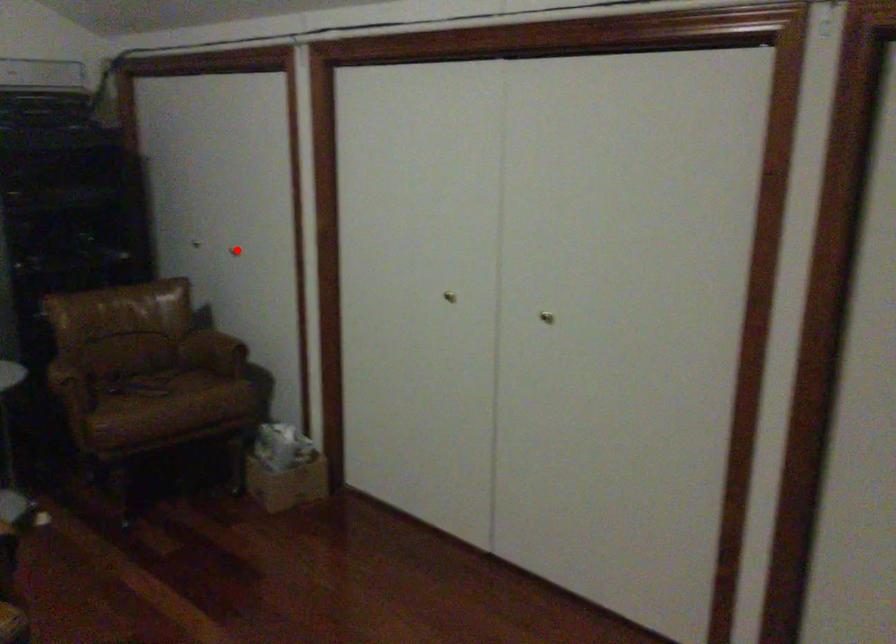
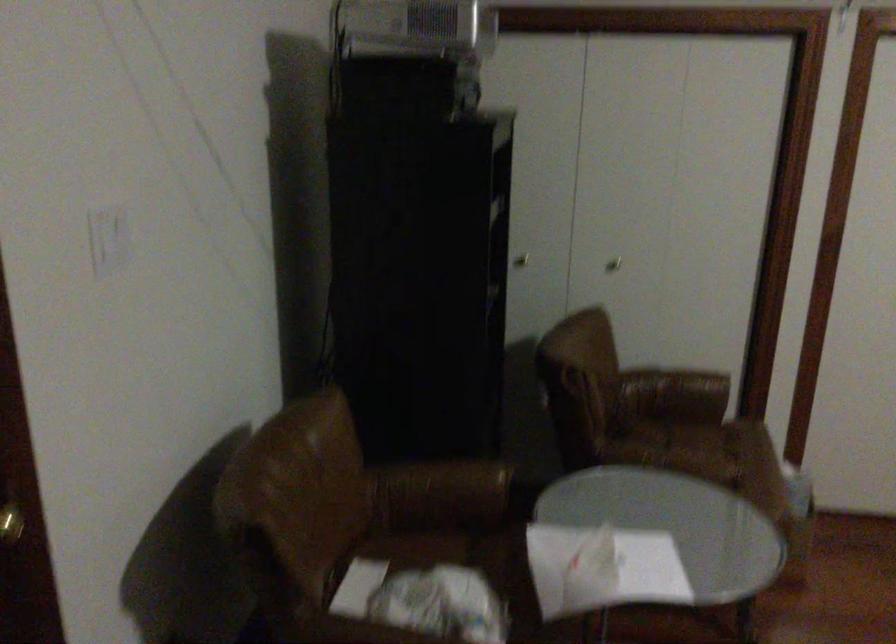
Find the pixel in the second image that matches the highlighted location in the first image.

(613, 263)